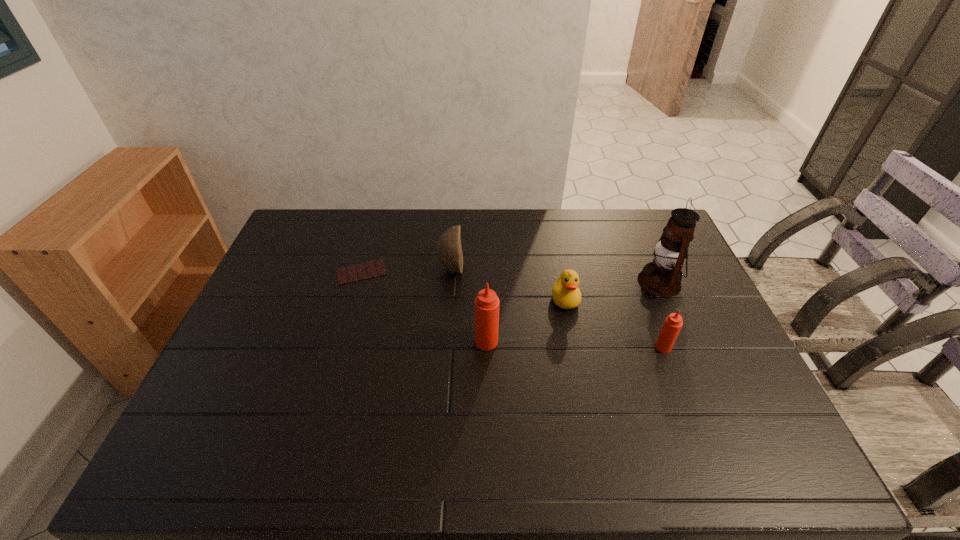
You are a GUI agent. You are given a task and a screenshot of the screen. Output one action in this format:
    pyautogui.click(x=<x>, y=<y>)
    Task: Click on the vacant space at the left edge of the desktop
    Image resolution: width=960 pixels, height=540 pixels.
    Given the screenshot: What is the action you would take?
    pyautogui.click(x=271, y=333)

Identify the location of vacant region at the right edge of the desktop. This screenshot has height=540, width=960. (732, 374).

Identify the location of vacant space at the near right corner of the desktop. (744, 395).

In order to click on vacant region between the bowl and the tallest object in this screenshot , I will do `click(555, 275)`.

This screenshot has width=960, height=540. I want to click on vacant area that lies between the leftmost object and the left Tabasco sauce, so click(423, 307).

Identify the location of vacant area between the duck and the left Tabasco sauce. (526, 320).

Locate an element on the screen. Image resolution: width=960 pixels, height=540 pixels. blank region between the fifth object from right to left and the taller Tabasco sauce is located at coordinates (468, 305).

Where is `vacant space that is in between the lantern and the taller Tabasco sauce`? vacant space that is in between the lantern and the taller Tabasco sauce is located at coordinates (573, 312).

This screenshot has width=960, height=540. Identify the location of vacant region between the shorter Tabasco sauce and the leftmost object. (512, 309).

At what (x,y) coordinates should I click in order to perform the action: click on free point between the bowl and the duck. Please return your answer as a coordinate pair (x, y). Looking at the image, I should click on (508, 284).